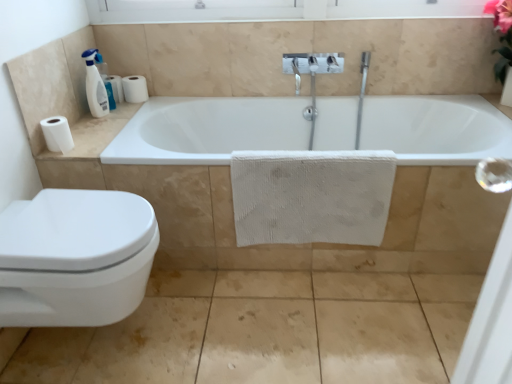
Question: Based on their sizes in the image, would you say white glossy toilet at lower left is bigger or smaller than white textured towel at center?

Choices:
 (A) big
 (B) small

Answer: (A)

Question: From the image's perspective, is white glossy toilet at lower left located above or below white textured towel at center?

Choices:
 (A) below
 (B) above

Answer: (A)

Question: Which of these objects is positioned farthest from the white matte paper towel at left?

Choices:
 (A) white glossy toilet at lower left
 (B) white glossy bathtub at center
 (C) white matte toilet paper at upper left, the 2th toilet paper ordered from the bottom
 (D) white textured towel at center
 (E) white matte toilet paper at left, the 1th toilet paper from the top

Answer: (D)

Question: Which is nearer to the white plastic bottle at upper left?

Choices:
 (A) white glossy toilet at lower left
 (B) white glossy bathtub at center
 (C) white matte toilet paper at upper left, marked as the 2th toilet paper in a top-to-bottom arrangement
 (D) matte beige tile at lower left
 (E) white textured towel at center

Answer: (C)